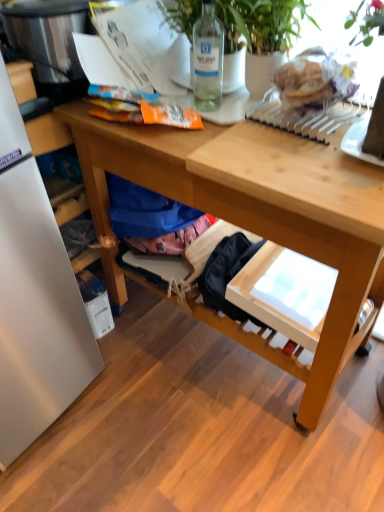
Question: Does stainless steel appliance at left turn towards wooden desk at center?

Choices:
 (A) yes
 (B) no

Answer: (B)

Question: Can we say stainless steel appliance at left lies outside wooden desk at center?

Choices:
 (A) no
 (B) yes

Answer: (B)

Question: Could wooden desk at center be considered to be inside stainless steel appliance at left?

Choices:
 (A) no
 (B) yes

Answer: (A)

Question: From the image's perspective, is stainless steel appliance at left under wooden desk at center?

Choices:
 (A) yes
 (B) no

Answer: (B)

Question: Considering the relative positions of stainless steel appliance at left and wooden desk at center in the image provided, is stainless steel appliance at left behind wooden desk at center?

Choices:
 (A) yes
 (B) no

Answer: (A)

Question: Is stainless steel appliance at left bigger than wooden desk at center?

Choices:
 (A) no
 (B) yes

Answer: (A)

Question: Can you confirm if wooden desk at center is wider than green leafy plant at upper right?

Choices:
 (A) no
 (B) yes

Answer: (B)

Question: Is green leafy plant at upper right a part of wooden desk at center?

Choices:
 (A) yes
 (B) no

Answer: (B)

Question: Does wooden desk at center appear on the left side of green leafy plant at upper right?

Choices:
 (A) yes
 (B) no

Answer: (A)

Question: Is wooden desk at center far from green leafy plant at upper right?

Choices:
 (A) no
 (B) yes

Answer: (A)

Question: From the image's perspective, would you say wooden desk at center is shown under green leafy plant at upper right?

Choices:
 (A) no
 (B) yes

Answer: (B)

Question: From the image's perspective, is wooden desk at center on green leafy plant at upper right?

Choices:
 (A) no
 (B) yes

Answer: (A)

Question: Is green leafy plant at upper right facing away from clear glass bottle at upper center?

Choices:
 (A) yes
 (B) no

Answer: (B)